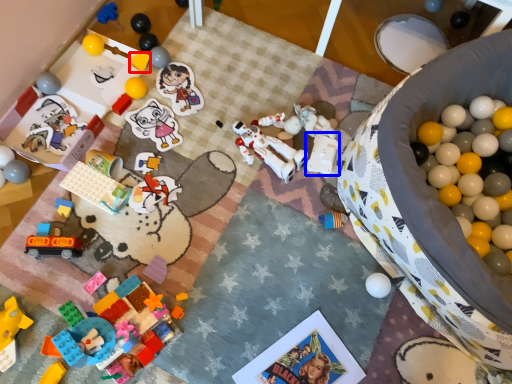
Question: Which of the following is the closest to the observer, toy (highlighted by a red box) or toy (highlighted by a blue box)?

Choices:
 (A) toy
 (B) toy

Answer: (B)